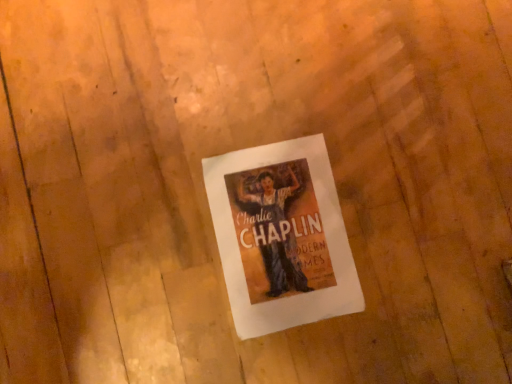
This screenshot has height=384, width=512. What are the coordinates of `free point below white paper at center (from a real-world perspective)` in the screenshot? It's located at (284, 233).